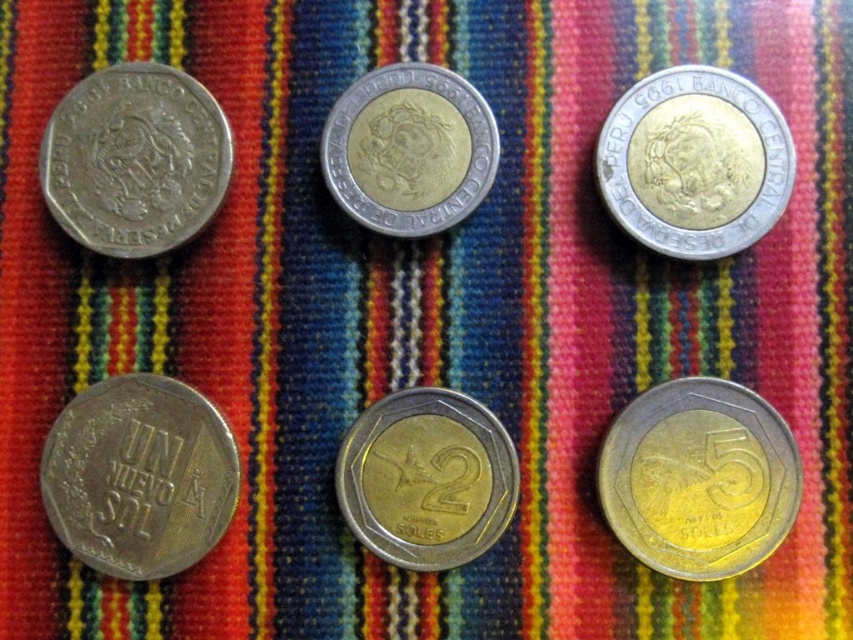
Question: Which point is closer to the camera?

Choices:
 (A) brass/bronze coin at bottom left
 (B) silver metallic coin at upper left
 (C) gold-plated metal coin at bottom right

Answer: (C)

Question: Is silver metallic coin at upper left to the right of silver/golden metallic coin at center from the viewer's perspective?

Choices:
 (A) yes
 (B) no

Answer: (B)

Question: Which of the following is the closest to the observer?

Choices:
 (A) gold-plated metal coin at center
 (B) silver metallic coin at upper left
 (C) silver/golden metallic coin at center
 (D) brass/bronze coin at bottom left

Answer: (D)

Question: Considering the relative positions of gold-plated metal coin at bottom right and brass/bronze coin at bottom left in the image provided, where is gold-plated metal coin at bottom right located with respect to brass/bronze coin at bottom left?

Choices:
 (A) right
 (B) left

Answer: (A)

Question: Does silver metallic coin at upper right have a smaller size compared to gold-plated metal coin at center?

Choices:
 (A) yes
 (B) no

Answer: (B)

Question: Which point is farther to the camera?

Choices:
 (A) (387, 544)
 (B) (677, 545)
 (C) (137, 390)
 (D) (189, 76)

Answer: (D)